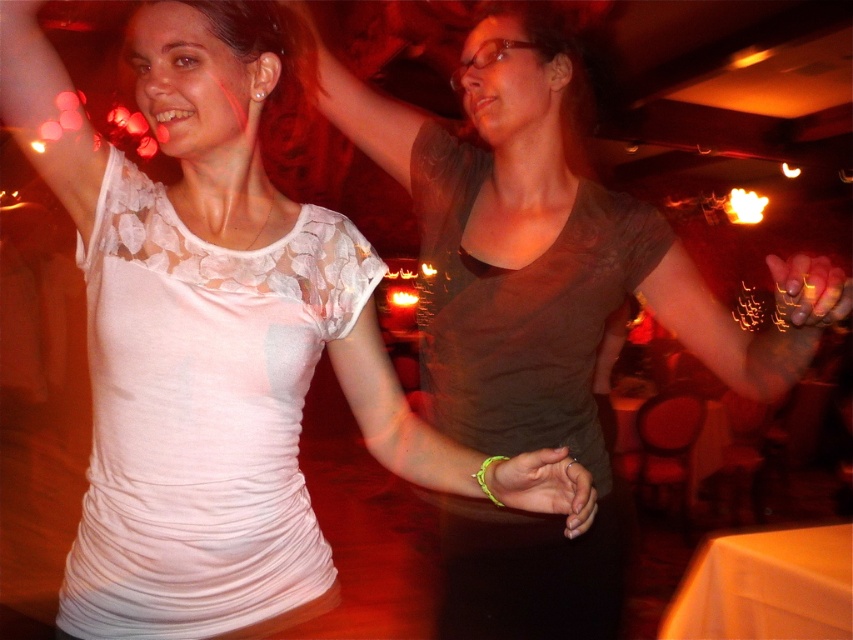
Question: Which point is farther to the camera?

Choices:
 (A) (479, 205)
 (B) (573, 525)
 (C) (297, 301)
 (D) (804, 292)

Answer: (A)

Question: Does matte brown shirt at center have a greater width compared to shiny gold nail polish at upper right?

Choices:
 (A) no
 (B) yes

Answer: (B)

Question: Considering the relative positions of matte brown shirt at center and shiny gold nail polish at upper right in the image provided, where is matte brown shirt at center located with respect to shiny gold nail polish at upper right?

Choices:
 (A) above
 (B) below

Answer: (B)

Question: Which of the following is the closest to the observer?

Choices:
 (A) (799, 291)
 (B) (100, 611)

Answer: (A)

Question: Which of these objects is positioned closest to the neon green wristband at center?

Choices:
 (A) matte brown shirt at center
 (B) shiny gold nail polish at upper right

Answer: (B)

Question: Does white lace top at upper left appear under neon green wristband at center?

Choices:
 (A) no
 (B) yes

Answer: (A)